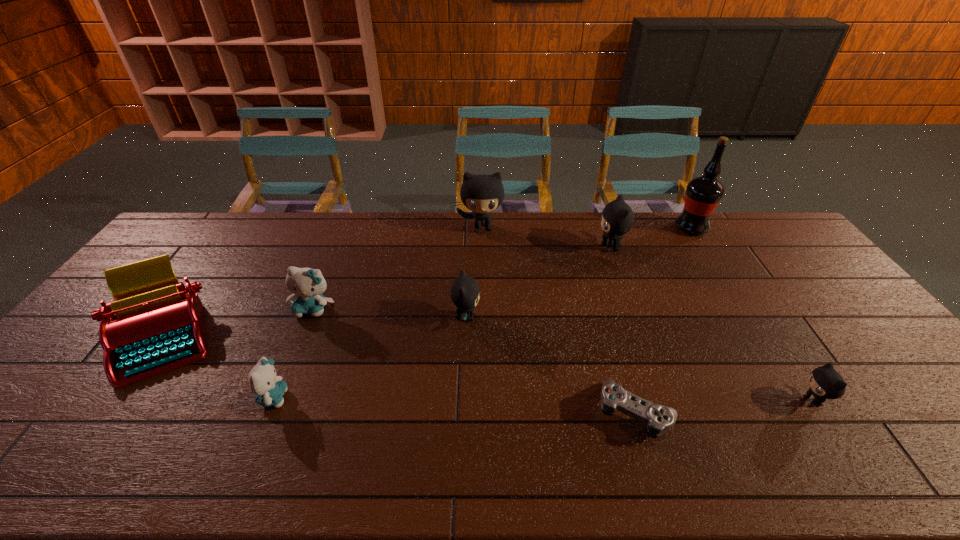
Where is `the tallest object`? This screenshot has width=960, height=540. the tallest object is located at coordinates (703, 194).

This screenshot has width=960, height=540. I want to click on red wine bottle, so click(x=703, y=194).

Identify the location of the tallest kitten. (482, 194).

Find the location of `the biggest gray kitten`. the biggest gray kitten is located at coordinates (482, 194).

The width and height of the screenshot is (960, 540). What are the coordinates of `the second biggest gray kitten` in the screenshot? It's located at (617, 218).

Find the location of a particular element. the third gray kitten from left to right is located at coordinates (617, 218).

You are a GUI agent. You are given a task and a screenshot of the screen. Output one action in this format:
    pyautogui.click(x=<x>, y=<y>)
    Task: Click on the bigger blue kitten
    This screenshot has width=960, height=540.
    Given the screenshot: What is the action you would take?
    pyautogui.click(x=307, y=284)

Image resolution: width=960 pixels, height=540 pixels. Identify the location of typewriter. (153, 326).

Locate an element on the screen. This screenshot has width=960, height=540. the second smallest gray kitten is located at coordinates (464, 292).

This screenshot has width=960, height=540. I want to click on the nearer blue kitten, so pyautogui.click(x=269, y=389).